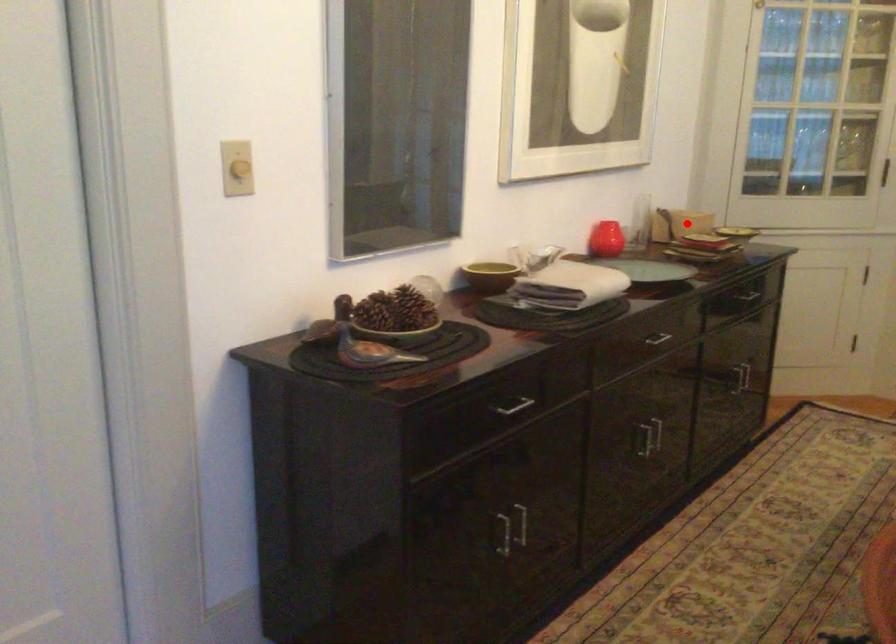
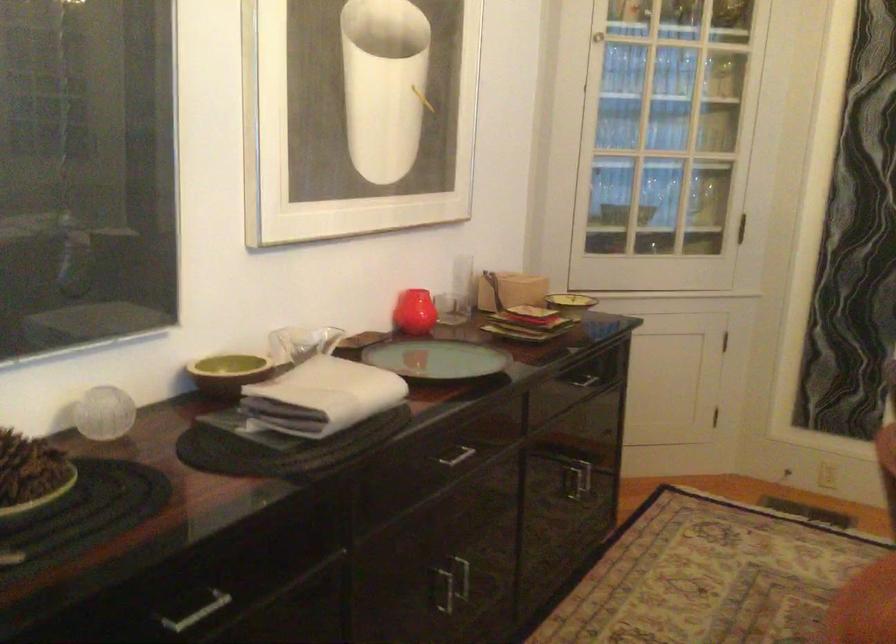
Question: I am providing you with two images of the same scene from different viewpoints. Image1 has a red point marked. In image2, the corresponding 3D location appears at what relative position? Reply with the corresponding letter.

Choices:
 (A) Closer
 (B) Farther

Answer: (A)